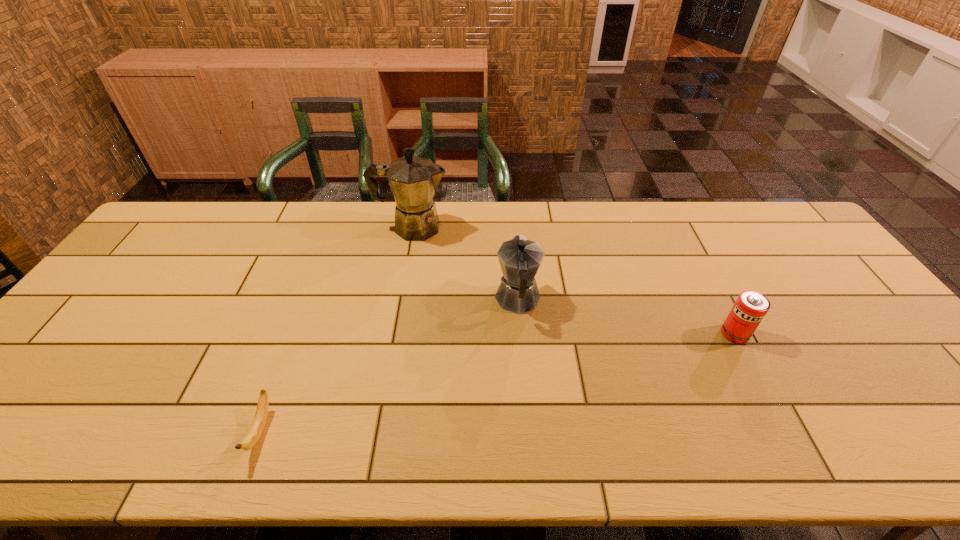
Where is `blank space located at the spout of the second tallest object`? This screenshot has width=960, height=540. blank space located at the spout of the second tallest object is located at coordinates (512, 230).

Where is `free space located 0.380m at the spout of the second tallest object`? The width and height of the screenshot is (960, 540). free space located 0.380m at the spout of the second tallest object is located at coordinates (510, 204).

Find the location of a particular element. The width and height of the screenshot is (960, 540). vacant space located on the left of the rightmost object is located at coordinates (622, 334).

The width and height of the screenshot is (960, 540). Find the location of `object that is at the far edge`. object that is at the far edge is located at coordinates (413, 180).

In order to click on object located at the near edge in this screenshot , I will do `click(258, 424)`.

The height and width of the screenshot is (540, 960). What are the coordinates of `vacant space at the far edge` in the screenshot? It's located at (234, 239).

At what (x,y) coordinates should I click in order to perform the action: click on free spot at the near edge of the desktop. Please return your answer as a coordinate pair (x, y). This screenshot has width=960, height=540. Looking at the image, I should click on (482, 456).

The image size is (960, 540). I want to click on vacant point at the left edge, so [x=146, y=273].

This screenshot has height=540, width=960. Find the location of `vacant space at the right edge of the desktop`. vacant space at the right edge of the desktop is located at coordinates (873, 328).

You are a GUI agent. You are given a task and a screenshot of the screen. Output one action in this format:
    pyautogui.click(x=<x>, y=<y>)
    Task: Click on the free space between the left coffeepot and the nearest object
    The width and height of the screenshot is (960, 540).
    Given the screenshot: What is the action you would take?
    pyautogui.click(x=336, y=329)